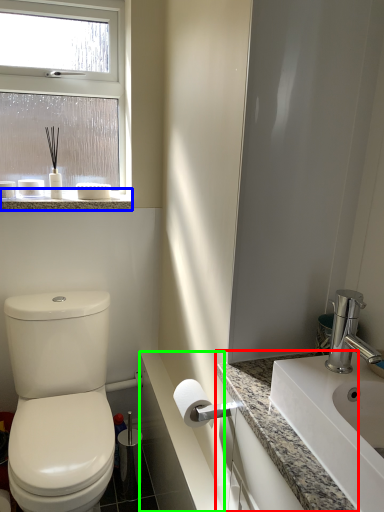
Question: Based on their relative distances, which object is nearer to counter top (highlighted by a red box)? Choose from window sill (highlighted by a blue box) and counter top (highlighted by a green box).

Choices:
 (A) window sill
 (B) counter top

Answer: (B)